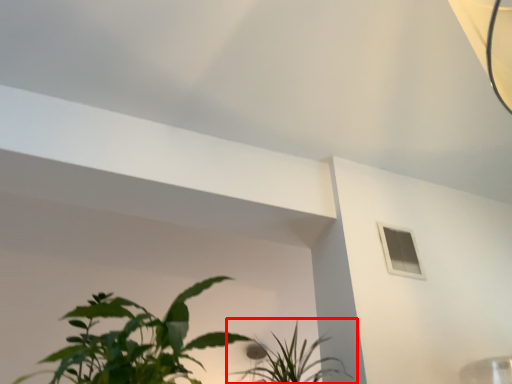
Question: Considering the relative positions of houseplant (annotated by the red box) and window in the image provided, where is houseplant (annotated by the red box) located with respect to the staircase?

Choices:
 (A) right
 (B) left

Answer: (B)